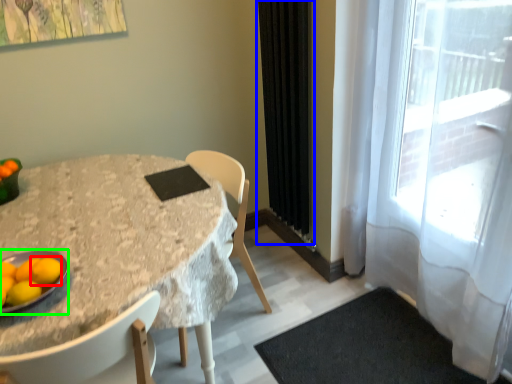
Question: Which is nearer to the orange (highlighted by a red box)? curtain (highlighted by a blue box) or platter (highlighted by a green box).

Choices:
 (A) curtain
 (B) platter

Answer: (B)